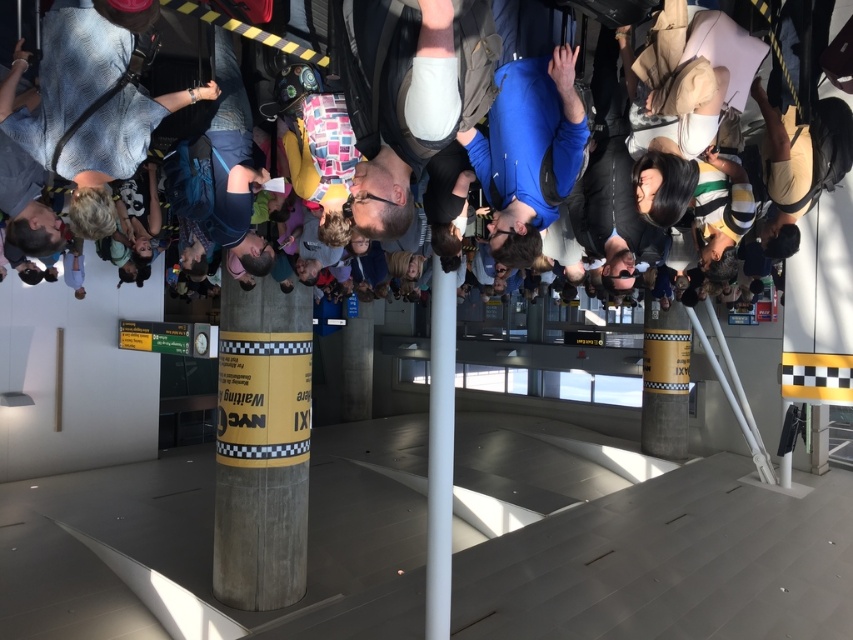
Can you confirm if matte black backpack at upper center is smaller than white smooth pole at center?

Actually, matte black backpack at upper center might be larger than white smooth pole at center.

Where is `matte black backpack at upper center`? The image size is (853, 640). matte black backpack at upper center is located at coordinates (416, 93).

Does point (483, 17) lie in front of point (445, 486)?

Yes.

Identify the location of matte black backpack at upper center. This screenshot has width=853, height=640. (416, 93).

Does wooden textured pillar at center have a greater height compared to white smooth pole at center?

Indeed, wooden textured pillar at center has a greater height compared to white smooth pole at center.

Who is higher up, wooden textured pillar at center or white smooth pole at center?

Positioned higher is white smooth pole at center.

Which is behind, point (294, 358) or point (450, 330)?

Point (294, 358)

Find the location of a particular element. The width and height of the screenshot is (853, 640). wooden textured pillar at center is located at coordinates (262, 448).

Who is shorter, matte black backpack at upper center or wooden textured pillar at center?

matte black backpack at upper center is shorter.

Between matte black backpack at upper center and wooden textured pillar at center, which one is positioned lower?

wooden textured pillar at center

Find the location of `matte black backpack at upper center`. matte black backpack at upper center is located at coordinates (416, 93).

What are the coordinates of `matte black backpack at upper center` in the screenshot? It's located at pos(416,93).